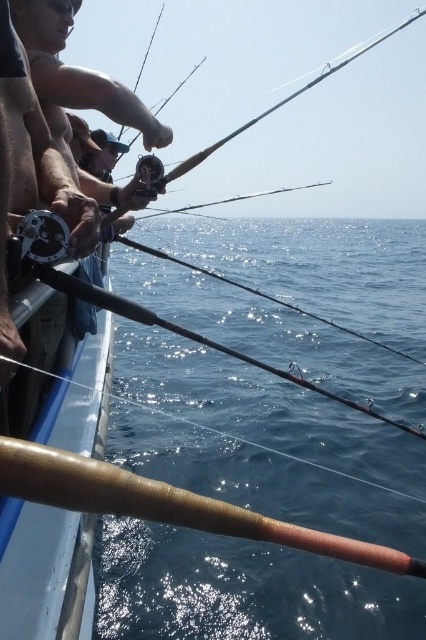
Question: Estimate the real-world distances between objects in this image. Which object is closer to the blue water at center?

Choices:
 (A) brown wood fishing rod at left
 (B) wooden textured fishing pole at lower left

Answer: (A)

Question: Which point is closer to the camera?

Choices:
 (A) (414, 305)
 (B) (131, 506)
 (C) (14, 381)

Answer: (B)

Question: Is brown wood fishing rod at left below wooden textured fishing pole at lower left?

Choices:
 (A) yes
 (B) no

Answer: (A)

Question: Is blue water at center thinner than wooden textured fishing pole at lower left?

Choices:
 (A) no
 (B) yes

Answer: (A)

Question: Can you confirm if blue water at center is smaller than wooden textured fishing pole at lower left?

Choices:
 (A) no
 (B) yes

Answer: (A)

Question: Which point is closer to the camera taking this photo?

Choices:
 (A) (422, 234)
 (B) (51, 358)
 (C) (348, 554)

Answer: (C)